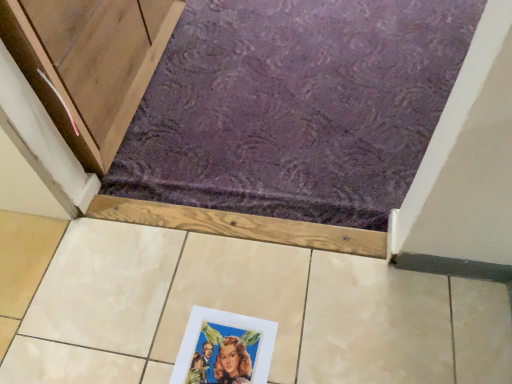
Locate an element on the screen. This screenshot has height=384, width=512. free location to the right of matte paper picture frame at lower center is located at coordinates (314, 334).